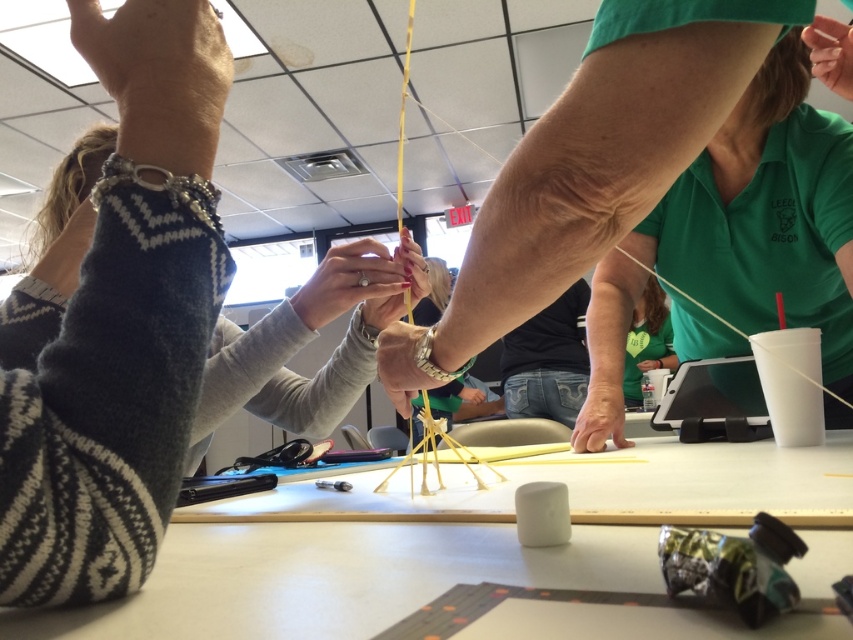
Looking at this image, you are standing in a classroom and see a smooth skin hand at upper left holding a pencil. Can you reach the hand to take the pencil?

The smooth skin hand at upper left and viewer are 2.98 meters apart, so you cannot reach the hand to take the pencil since it is too far away.

You are an observer in the classroom. You notice two hands working on the project. The smooth skin hand at upper left and the matte green hand at center. Which hand is wider?

The smooth skin hand at upper left is wider than the matte green hand at center.

You are a student in the classroom and you see the green fabric shirt at upper center and the matte yellow stick at center. Which object is shorter?

The green fabric shirt at upper center is shorter than the matte yellow stick at center.